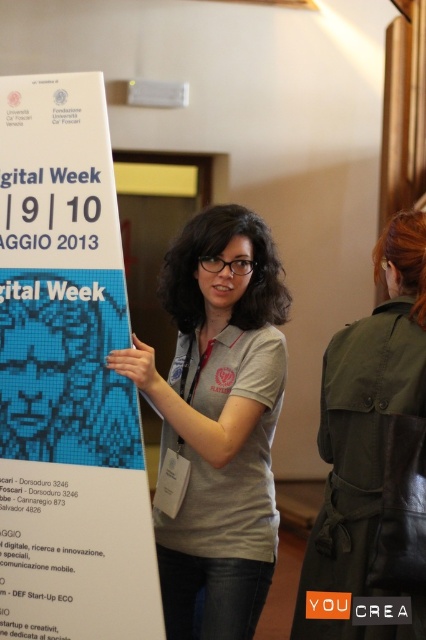
You are observing the poster and the woman in the image. Can you determine which of the two points, point (278, 273) or point (365, 557), is closer to the camera?

Point (365, 557) is closer to the camera than point (278, 273) because the description states that point (278, 273) is further away.

From the picture: You are a photographer standing in front of the scene. You want to take a photo of the white paper poster at upper left and the gray fabric shirt at center. How far apart are these two objects in the image?

The white paper poster at upper left is 14.49 inches away from the gray fabric shirt at center.